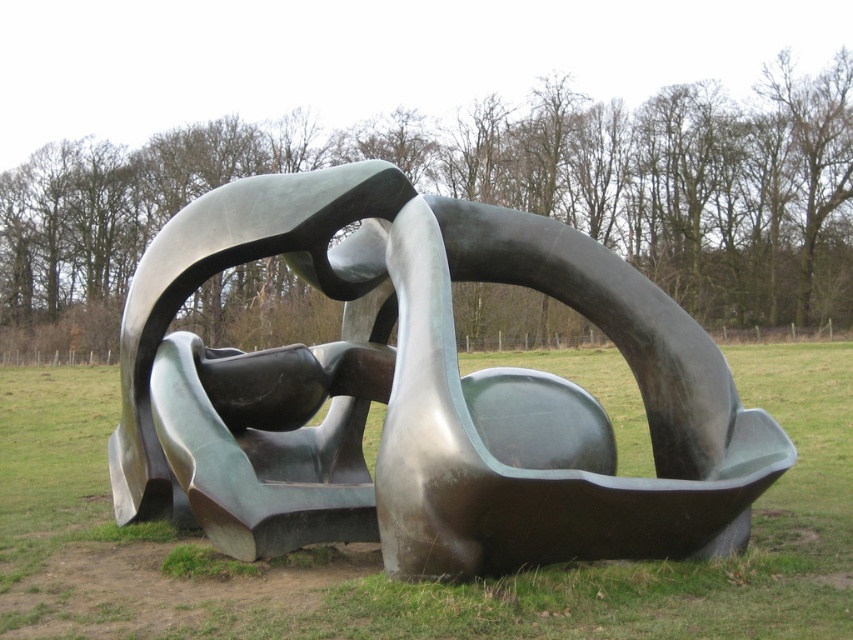
Is polished bronze sculpture at center further to the viewer compared to bronze sculpture at center?

Yes, polished bronze sculpture at center is behind bronze sculpture at center.

Does point (402, 364) come behind point (653, 630)?

Yes, point (402, 364) is behind point (653, 630).

What do you see at coordinates (421, 394) in the screenshot? I see `polished bronze sculpture at center` at bounding box center [421, 394].

You are a GUI agent. You are given a task and a screenshot of the screen. Output one action in this format:
    pyautogui.click(x=<x>, y=<y>)
    Task: Click on the polished bronze sculpture at center
    
    Given the screenshot: What is the action you would take?
    pyautogui.click(x=421, y=394)